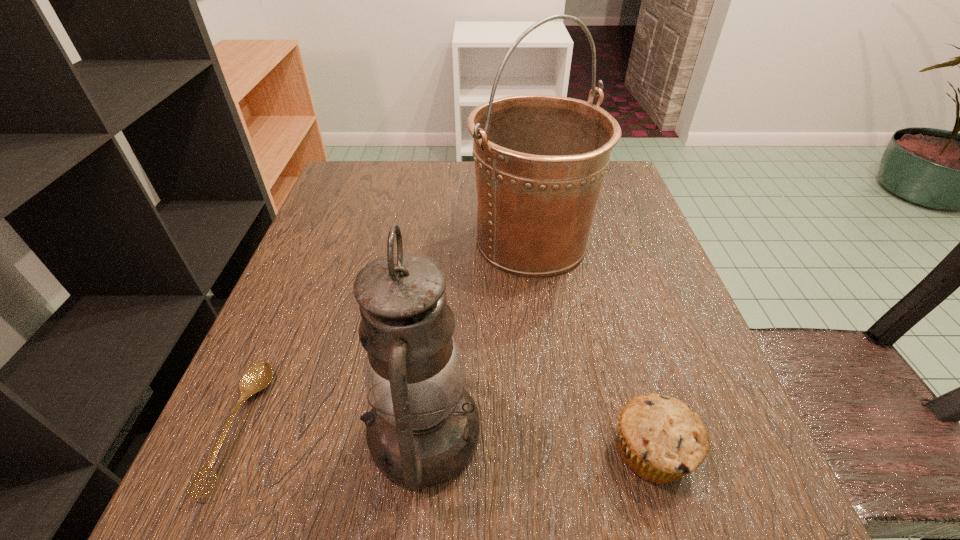
You are a GUI agent. You are given a task and a screenshot of the screen. Output one action in this format:
    pyautogui.click(x=<x>, y=<y>)
    Task: Click on the unoccupied position between the oil lamp and the farthest object
    The height and width of the screenshot is (540, 960).
    Given the screenshot: What is the action you would take?
    pyautogui.click(x=477, y=338)

The width and height of the screenshot is (960, 540). What are the coordinates of `empty location between the shortest object and the oil lamp` in the screenshot? It's located at (331, 431).

Locate which object ranks in proximity to the oil lamp. Please provide its 2D coordinates. Your answer should be formatted as a tuple, i.e. [(x, y)], where the tuple contains the x and y coordinates of a point satisfying the conditions above.

[(258, 377)]

Find the location of `object identified as the closest to the shortest object`. object identified as the closest to the shortest object is located at coordinates (423, 429).

This screenshot has width=960, height=540. What are the coordinates of `free space that satisfies the following two spatial constraints: 1. on the back side of the leftmost object; 2. on the right side of the bucket` in the screenshot? It's located at (320, 241).

Locate an element on the screen. The width and height of the screenshot is (960, 540). free space that satisfies the following two spatial constraints: 1. on the back side of the tallest object; 2. on the right side of the leftmost object is located at coordinates (320, 241).